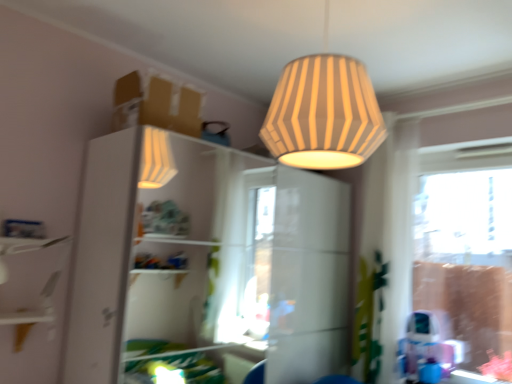
Question: Is white glossy dresser at upper center at the left side of clear glass window at right?

Choices:
 (A) no
 (B) yes

Answer: (B)

Question: Considering the relative positions of white glossy dresser at upper center and clear glass window at right in the image provided, is white glossy dresser at upper center behind clear glass window at right?

Choices:
 (A) no
 (B) yes

Answer: (A)

Question: Is white glossy dresser at upper center wider than clear glass window at right?

Choices:
 (A) yes
 (B) no

Answer: (A)

Question: From the image's perspective, is white glossy dresser at upper center located above clear glass window at right?

Choices:
 (A) no
 (B) yes

Answer: (A)

Question: Is clear glass window at right at the back of white glossy dresser at upper center?

Choices:
 (A) no
 (B) yes

Answer: (A)

Question: Is white glossy dresser at upper center far from clear glass window at right?

Choices:
 (A) no
 (B) yes

Answer: (B)

Question: Is white glossy dresser at upper center beside striped paper lampshade at upper center?

Choices:
 (A) no
 (B) yes

Answer: (A)

Question: From a real-world perspective, is white glossy dresser at upper center on top of striped paper lampshade at upper center?

Choices:
 (A) yes
 (B) no

Answer: (B)

Question: Is white glossy dresser at upper center not near striped paper lampshade at upper center?

Choices:
 (A) yes
 (B) no

Answer: (A)

Question: Considering the relative sizes of white glossy dresser at upper center and striped paper lampshade at upper center in the image provided, is white glossy dresser at upper center thinner than striped paper lampshade at upper center?

Choices:
 (A) no
 (B) yes

Answer: (A)

Question: Does white glossy dresser at upper center lie in front of striped paper lampshade at upper center?

Choices:
 (A) yes
 (B) no

Answer: (B)

Question: Is white glossy dresser at upper center facing towards striped paper lampshade at upper center?

Choices:
 (A) yes
 (B) no

Answer: (A)

Question: From the image's perspective, does white glossy shelf at left appear higher than white glossy dresser at upper center?

Choices:
 (A) yes
 (B) no

Answer: (A)